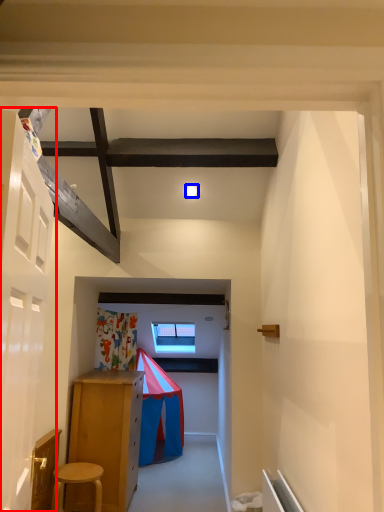
Question: Which object appears farthest to the camera in this image, door (highlighted by a red box) or light (highlighted by a blue box)?

Choices:
 (A) door
 (B) light

Answer: (B)